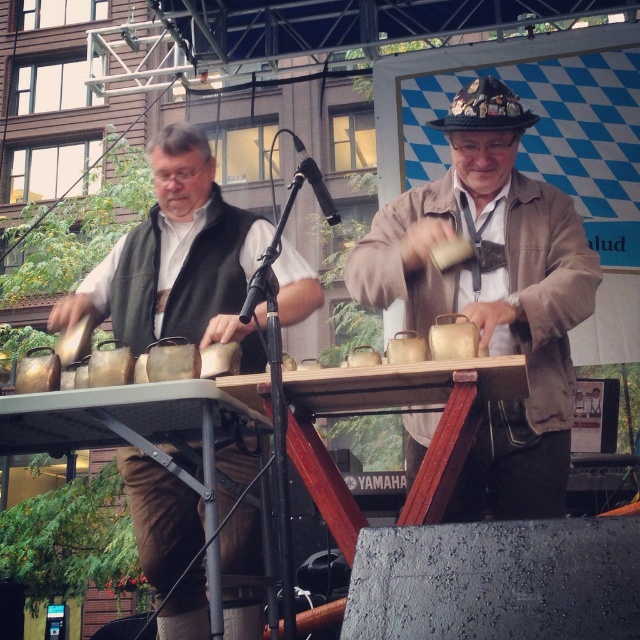
You are a photographer standing at the camera position. You want to capture a closeup of the matte brown leather jacket at center without moving the camera. Is the jacket within the camera focus range of 2.5 meters?

The matte brown leather jacket at center is 2.55 meters from the camera, which is slightly beyond the 2.5 meters focus range. Therefore, the jacket will be slightly out of focus unless the focus is adjusted.

You are a photographer positioned in front of the two musicians. You need to take a photo that includes both the matte brown leather jacket at center and the matte black vest at left. Based on their positions, which object should you focus on first to ensure both are in frame?

The matte brown leather jacket at center is to the right of the matte black vest at left. To capture both in the frame, focus on the matte black vest at left first as it is on the left side, ensuring the jacket at center remains within the right side of the frame.